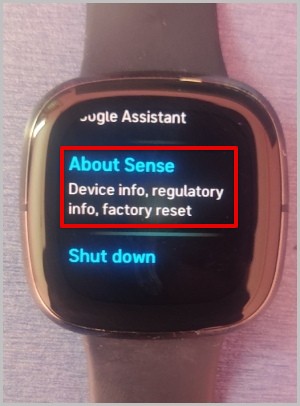
The image size is (300, 406). Identify the location of table. (260, 360).